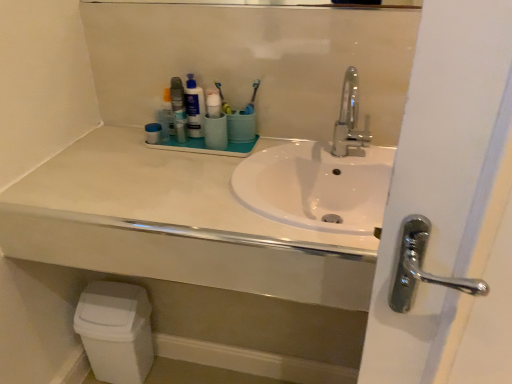
This screenshot has height=384, width=512. Identify the location of free space on the front side of blue glossy lotion at center. (184, 159).